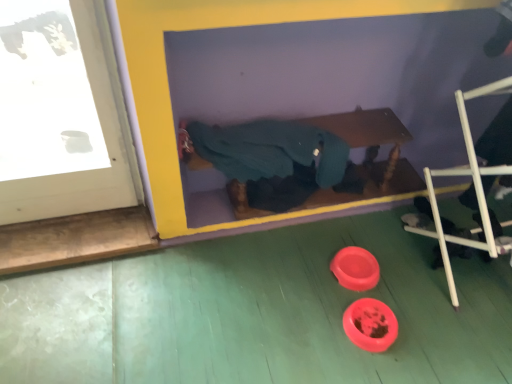
Question: Is white plastic ladder at lower right thinner than teal fabric at center?

Choices:
 (A) yes
 (B) no

Answer: (B)

Question: Does white plastic ladder at lower right appear on the left side of teal fabric at center?

Choices:
 (A) no
 (B) yes

Answer: (A)

Question: Could you tell me if white plastic ladder at lower right is turned towards teal fabric at center?

Choices:
 (A) yes
 (B) no

Answer: (B)

Question: Does white plastic ladder at lower right have a greater height compared to teal fabric at center?

Choices:
 (A) yes
 (B) no

Answer: (A)

Question: Is white plastic ladder at lower right placed right next to teal fabric at center?

Choices:
 (A) yes
 (B) no

Answer: (B)

Question: Would you say white plastic ladder at lower right contains teal fabric at center?

Choices:
 (A) yes
 (B) no

Answer: (B)

Question: From a real-world perspective, is teal fabric at center positioned under white plastic ladder at lower right based on gravity?

Choices:
 (A) yes
 (B) no

Answer: (A)

Question: Is the depth of teal fabric at center less than that of white plastic ladder at lower right?

Choices:
 (A) yes
 (B) no

Answer: (B)

Question: Does teal fabric at center have a lesser width compared to white plastic ladder at lower right?

Choices:
 (A) yes
 (B) no

Answer: (A)

Question: Can you confirm if teal fabric at center is shorter than white plastic ladder at lower right?

Choices:
 (A) no
 (B) yes

Answer: (B)

Question: Is teal fabric at center positioned with its back to white plastic ladder at lower right?

Choices:
 (A) no
 (B) yes

Answer: (A)

Question: Can you confirm if teal fabric at center is positioned to the left of white plastic ladder at lower right?

Choices:
 (A) no
 (B) yes

Answer: (B)

Question: Is white plastic ladder at lower right taller or shorter than teal fabric at center?

Choices:
 (A) short
 (B) tall

Answer: (B)